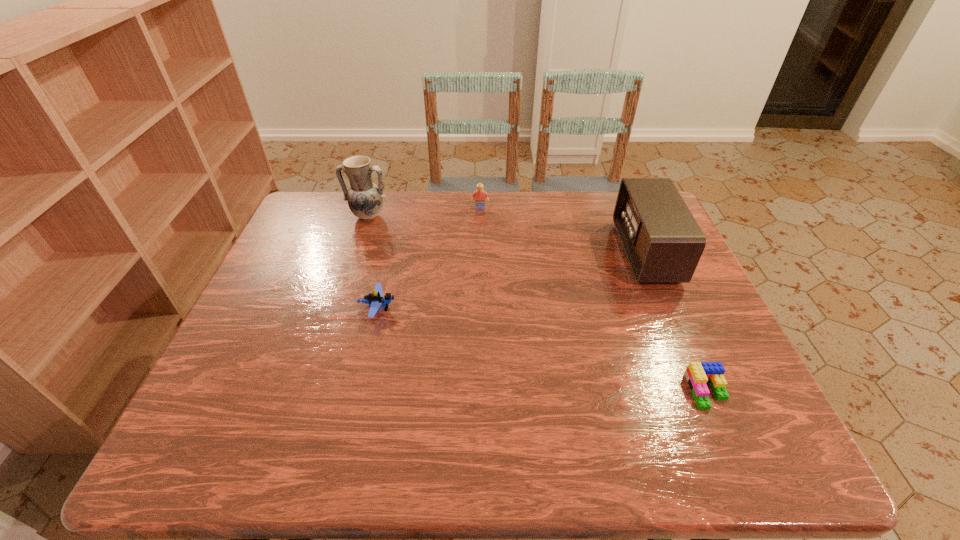
This screenshot has width=960, height=540. What are the coordinates of `Lego that is positioned at the right edge` in the screenshot? It's located at (697, 374).

What are the coordinates of `object present at the far left corner` in the screenshot? It's located at (365, 199).

You are a GUI agent. You are given a task and a screenshot of the screen. Output one action in this format:
    pyautogui.click(x=<x>, y=<y>)
    Task: Click on the object that is at the far right corner
    Image resolution: width=960 pixels, height=540 pixels.
    Given the screenshot: What is the action you would take?
    pyautogui.click(x=663, y=243)

At what (x,y) coordinates should I click in order to perform the action: click on vacant space at the far edge of the desktop. Please return your answer as a coordinate pair (x, y). Looking at the image, I should click on coord(489,203).

This screenshot has height=540, width=960. In order to click on vacant space at the near edge in this screenshot , I will do `click(366, 438)`.

Where is `vacant space at the left edge of the desktop`? vacant space at the left edge of the desktop is located at coordinates (261, 352).

Identify the location of free spot at the right edge of the desktop. The image size is (960, 540). (692, 312).

Locate an element on the screen. vacant space at the near left corner is located at coordinates (244, 427).

You are a GUI agent. You are given a task and a screenshot of the screen. Output one action in this format:
    pyautogui.click(x=<x>, y=<y>)
    Task: Click on the free point between the radio receiver and the second tallest Lego
    
    Given the screenshot: What is the action you would take?
    (512, 281)

The height and width of the screenshot is (540, 960). Identify the location of free space between the pottery and the radio receiver. (507, 234).